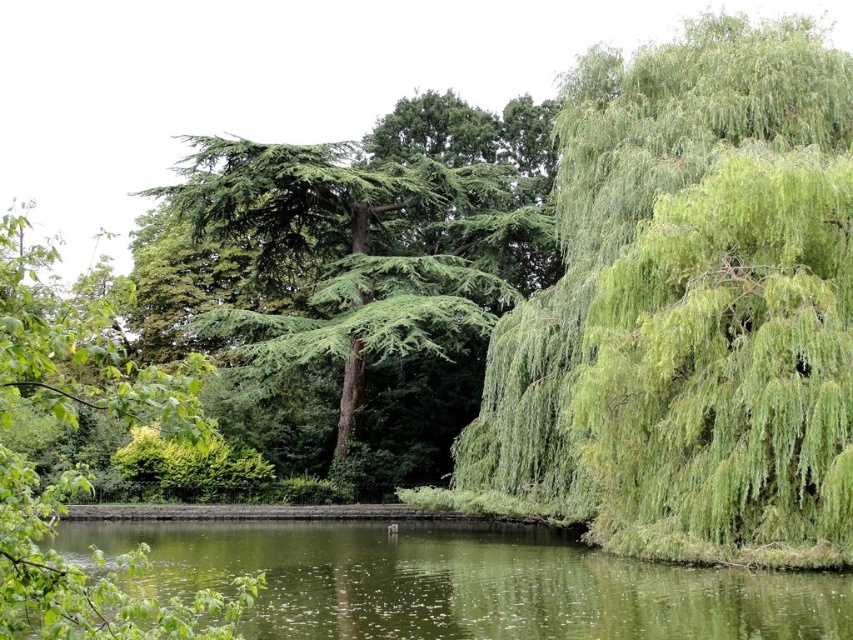
Is green liquid water at center wider than green leafy willow at right?

Yes, green liquid water at center is wider than green leafy willow at right.

Between green liquid water at center and green leafy willow at right, which one appears on the left side from the viewer's perspective?

Positioned to the left is green liquid water at center.

Is point (383, 628) closer to camera compared to point (636, 173)?

Yes, point (383, 628) is in front of point (636, 173).

Where is `green liquid water at center`? green liquid water at center is located at coordinates (461, 582).

Which is in front, point (607, 624) or point (26, 502)?

Positioned in front is point (26, 502).

Does green liquid water at center appear under green textured tree at upper left?

Yes, green liquid water at center is below green textured tree at upper left.

Between point (300, 557) and point (22, 611), which one is positioned in front?

Point (22, 611)

Find the location of `green liquid water at center`. green liquid water at center is located at coordinates (461, 582).

Between green needle-like at center and green liquid water at center, which one has less height?

green liquid water at center is shorter.

Is green needle-like at center positioned before green liquid water at center?

No.

Identify the location of green needle-like at center. This screenshot has width=853, height=640. (361, 266).